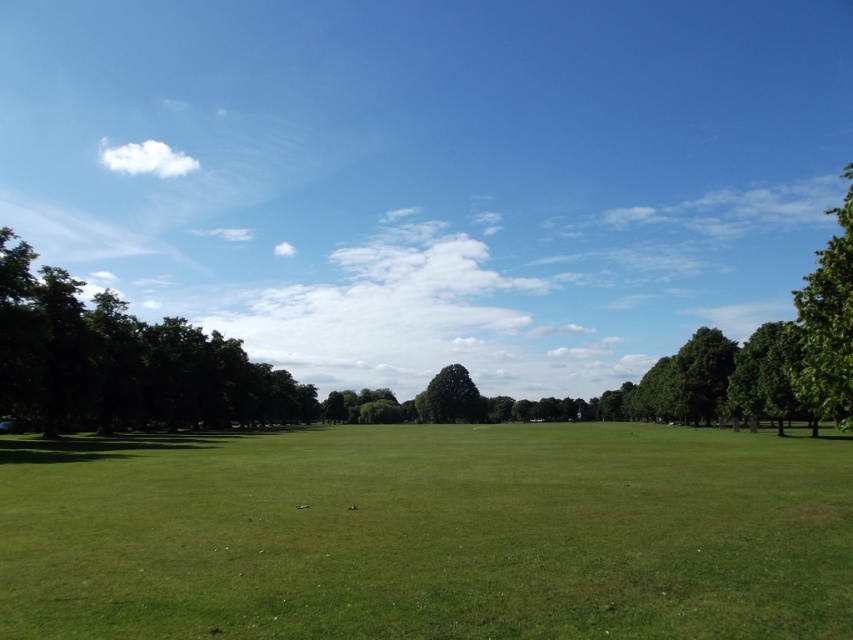
Question: Estimate the real-world distances between objects in this image. Which object is farther from the green leafy tree at left?

Choices:
 (A) green leafy tree at center
 (B) green grass at center

Answer: (A)

Question: Does green leafy tree at left have a greater width compared to green leafy tree at center?

Choices:
 (A) yes
 (B) no

Answer: (B)

Question: Is green grass at center positioned at the back of green leafy tree at right?

Choices:
 (A) yes
 (B) no

Answer: (B)

Question: Which object is positioned closest to the green grass at center?

Choices:
 (A) green leafy tree at center
 (B) green leafy tree at left
 (C) green leafy tree at right

Answer: (C)

Question: Which object is farther from the camera taking this photo?

Choices:
 (A) green leafy tree at left
 (B) green grass at center

Answer: (A)

Question: Observing the image, what is the correct spatial positioning of green leafy tree at left in reference to green leafy tree at right?

Choices:
 (A) above
 (B) below

Answer: (B)